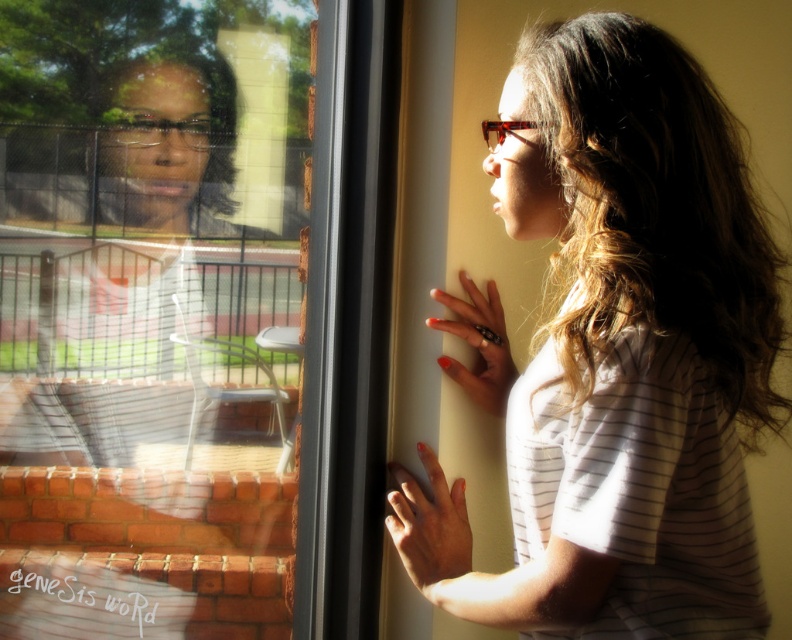
You are trying to determine if you can fit a rectangular box that is 1.2 meters wide through the space between the transparent glass screen door at left and the matte white shirt at center. Based on the scene description, can you confirm if the space is wide enough?

The transparent glass screen door at left might be wider than matte white shirt at center, so the space between them could potentially accommodate the 1.2 meter wide box. However, since the exact width isn not specified, it is uncertain.

You are holding a 1.2 meter wide painting and want to hang it on the wall next to the transparent glass screen door at left. Is there enough space between the door and the wall to fit the painting?

The transparent glass screen door at left and viewer are 1.31 meters apart from each other, so yes, the painting can be hung there since the space is wider than the painting.

You are trying to exit through the transparent glass screen door at left but notice the matte white shirt at center is blocking your path. Can you still exit through the door?

The transparent glass screen door at left is to the left of the matte white shirt at center, so the door is not blocked by the shirt and you can exit through it.